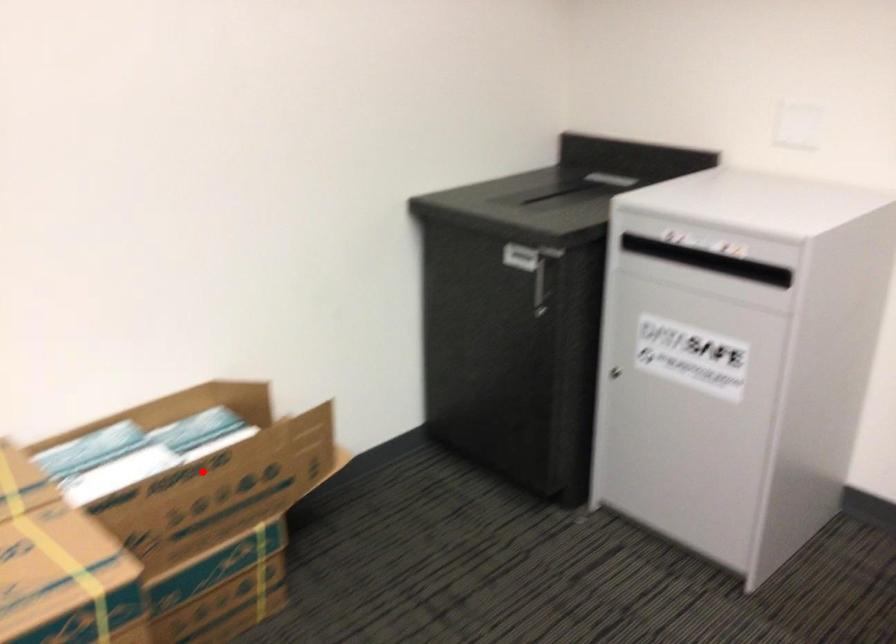
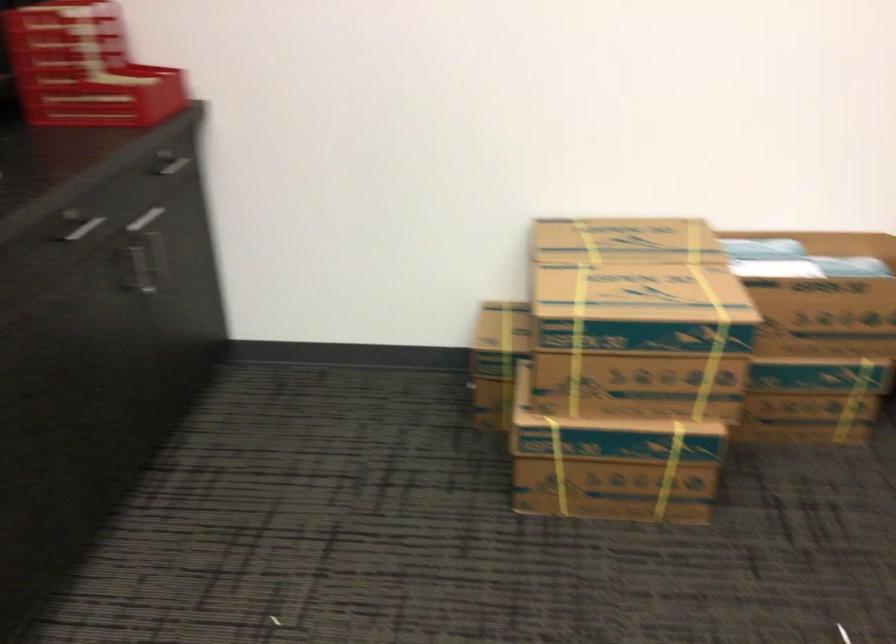
Find the pixel in the second image that matches the highlighted location in the first image.

(828, 286)